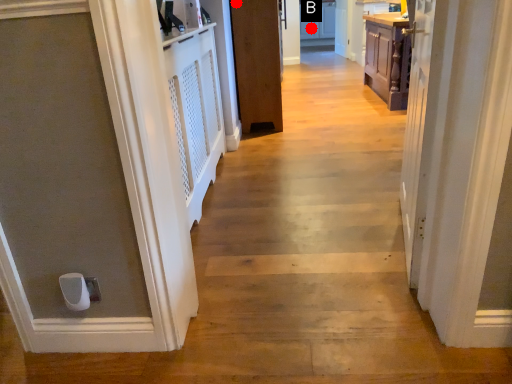
Question: Two points are circled on the image, labeled by A and B beside each circle. Which of the following is the closest to the observer?

Choices:
 (A) A is closer
 (B) B is closer

Answer: (A)